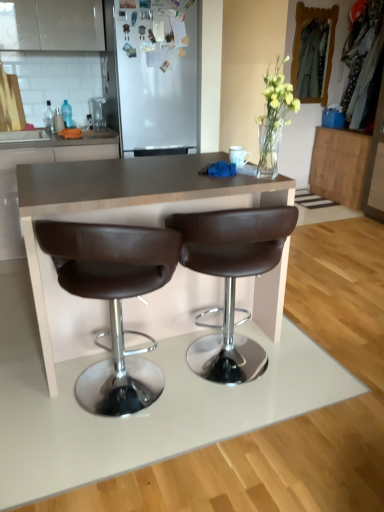
You are a GUI agent. You are given a task and a screenshot of the screen. Output one action in this format:
    pyautogui.click(x=<x>, y=<y>)
    Task: Click on the brown leather table at center
    
    Given the screenshot: What is the action you would take?
    pyautogui.click(x=117, y=223)

Image resolution: width=384 pixels, height=512 pixels. What do you see at coordinates (231, 278) in the screenshot?
I see `brown leather stool at center, the 2th chair positioned from the left` at bounding box center [231, 278].

Locate an element on the screen. Image resolution: width=384 pixels, height=512 pixels. brown leather stool at center, arranged as the 1th chair when viewed from the right is located at coordinates (231, 278).

Locate an element on the screen. brown leather stool at center, positioned as the first chair in left-to-right order is located at coordinates (113, 300).

What do you see at coordinates (113, 300) in the screenshot?
I see `brown leather stool at center, positioned as the first chair in left-to-right order` at bounding box center [113, 300].

Where is `white matte refrigerator at upper center`? This screenshot has width=384, height=512. white matte refrigerator at upper center is located at coordinates (154, 73).

This screenshot has width=384, height=512. Find the location of `wooden cabinet at right, placed as the 2th cabinetry when sorted from left to right`. wooden cabinet at right, placed as the 2th cabinetry when sorted from left to right is located at coordinates (340, 165).

Visually, is wooden cabinet at right, which ranks as the 1th cabinetry in back-to-front order, positioned to the left or to the right of brown leather cabinet at center, acting as the 1th cabinetry starting from the left?

wooden cabinet at right, which ranks as the 1th cabinetry in back-to-front order, is to the right of brown leather cabinet at center, acting as the 1th cabinetry starting from the left.

In the scene shown: Is wooden cabinet at right, which ranks as the 2th cabinetry in front-to-back order, facing away from brown leather cabinet at center, acting as the 1th cabinetry starting from the left?

No, wooden cabinet at right, which ranks as the 2th cabinetry in front-to-back order,'s orientation is not away from brown leather cabinet at center, acting as the 1th cabinetry starting from the left.

Does wooden cabinet at right, which ranks as the 2th cabinetry in front-to-back order, contain brown leather cabinet at center, placed as the 2th cabinetry when sorted from back to front?

No, brown leather cabinet at center, placed as the 2th cabinetry when sorted from back to front, is not a part of wooden cabinet at right, which ranks as the 2th cabinetry in front-to-back order.

Locate an element on the screen. This screenshot has width=384, height=512. cabinetry on the right of brown leather cabinet at center, arranged as the 1th cabinetry when viewed from the front is located at coordinates (340, 165).

From a real-world perspective, is white matte refrigerator at upper center positioned over brown leather table at center based on gravity?

Yes.

Is white matte refrigerator at upper center taller or shorter than brown leather table at center?

Considering their sizes, white matte refrigerator at upper center has more height than brown leather table at center.

How different are the orientations of white matte refrigerator at upper center and brown leather table at center in degrees?

They differ by 0.707 degrees in their facing directions.

In terms of size, does white matte refrigerator at upper center appear bigger or smaller than brown leather table at center?

white matte refrigerator at upper center is smaller than brown leather table at center.

From their relative heights in the image, would you say brown leather stool at center, positioned as the first chair in left-to-right order, is taller or shorter than brown leather cabinet at center, acting as the 1th cabinetry starting from the left?

Clearly, brown leather stool at center, positioned as the first chair in left-to-right order, is taller compared to brown leather cabinet at center, acting as the 1th cabinetry starting from the left.

Looking at their sizes, would you say brown leather stool at center, positioned as the first chair in left-to-right order, is wider or thinner than brown leather cabinet at center, acting as the 1th cabinetry starting from the left?

Clearly, brown leather stool at center, positioned as the first chair in left-to-right order, has less width compared to brown leather cabinet at center, acting as the 1th cabinetry starting from the left.

From the picture: Is the position of brown leather stool at center, positioned as the first chair in left-to-right order, more distant than that of brown leather cabinet at center, arranged as the 1th cabinetry when viewed from the front?

No, the depth of brown leather stool at center, positioned as the first chair in left-to-right order, is less than that of brown leather cabinet at center, arranged as the 1th cabinetry when viewed from the front.

Is brown leather stool at center, positioned as the first chair in left-to-right order, with brown leather cabinet at center, arranged as the 1th cabinetry when viewed from the front?

No, brown leather stool at center, positioned as the first chair in left-to-right order, is not next to brown leather cabinet at center, arranged as the 1th cabinetry when viewed from the front.

From the image's perspective, is wooden cabinet at right, placed as the 2th cabinetry when sorted from left to right, above or below matte white drawer at left?

From the image's perspective, wooden cabinet at right, placed as the 2th cabinetry when sorted from left to right, appears above matte white drawer at left.

Is wooden cabinet at right, which ranks as the 2th cabinetry in front-to-back order, facing away from matte white drawer at left?

No.

Which of these two, wooden cabinet at right, placed as the 2th cabinetry when sorted from left to right, or matte white drawer at left, is wider?

matte white drawer at left is wider.

Can you tell me how much wooden cabinet at right, which ranks as the 1th cabinetry in back-to-front order, and matte white drawer at left differ in facing direction?

They differ by 90.1 degrees in their facing directions.

Which cabinetry is the 1st one when counting from the back of the brown leather stool at center, acting as the second chair starting from the right? Please provide its 2D coordinates.

[(42, 162)]

Can you confirm if brown leather cabinet at center, acting as the 1th cabinetry starting from the left, is smaller than brown leather stool at center, acting as the second chair starting from the right?

Actually, brown leather cabinet at center, acting as the 1th cabinetry starting from the left, might be larger than brown leather stool at center, acting as the second chair starting from the right.

Considering the positions of objects brown leather cabinet at center, acting as the 1th cabinetry starting from the left, and brown leather stool at center, positioned as the first chair in left-to-right order, in the image provided, who is more to the left, brown leather cabinet at center, acting as the 1th cabinetry starting from the left, or brown leather stool at center, positioned as the first chair in left-to-right order,?

brown leather cabinet at center, acting as the 1th cabinetry starting from the left, is more to the left.

Is brown leather cabinet at center, the 2th cabinetry in the right-to-left sequence, oriented away from brown leather stool at center, positioned as the first chair in left-to-right order?

No.

Does brown leather table at center contain brown leather cabinet at center, acting as the 1th cabinetry starting from the left?

No, brown leather table at center does not contain brown leather cabinet at center, acting as the 1th cabinetry starting from the left.

Is brown leather table at center not near brown leather cabinet at center, arranged as the 1th cabinetry when viewed from the front?

Yes.

Can you confirm if brown leather table at center is positioned to the right of brown leather cabinet at center, acting as the 1th cabinetry starting from the left?

Yes, brown leather table at center is to the right of brown leather cabinet at center, acting as the 1th cabinetry starting from the left.

How many degrees apart are the facing directions of white matte refrigerator at upper center and matte white drawer at left?

The angular difference between white matte refrigerator at upper center and matte white drawer at left is 0.000327 degrees.

From a real-world perspective, relative to matte white drawer at left, is white matte refrigerator at upper center vertically above or below?

white matte refrigerator at upper center is situated higher than matte white drawer at left in the real world.

Which object is positioned more to the left, white matte refrigerator at upper center or matte white drawer at left?

matte white drawer at left is more to the left.

Considering the sizes of white matte refrigerator at upper center and matte white drawer at left in the image, is white matte refrigerator at upper center wider or thinner than matte white drawer at left?

In the image, white matte refrigerator at upper center appears to be wider than matte white drawer at left.

I want to click on cabinetry lying in front of the wooden cabinet at right, placed as the 2th cabinetry when sorted from left to right, so click(42, 162).

The height and width of the screenshot is (512, 384). In order to click on fridge that is above the brown leather table at center (from the image's perspective) in this screenshot , I will do `click(154, 73)`.

Looking at this image, estimate the real-world distances between objects in this image. Which object is closer to brown leather stool at center, the 2th chair positioned from the left, brown leather cabinet at center, placed as the 2th cabinetry when sorted from back to front, or matte white drawer at left?

Among the two, brown leather cabinet at center, placed as the 2th cabinetry when sorted from back to front, is located nearer to brown leather stool at center, the 2th chair positioned from the left.

When comparing their distances from white matte refrigerator at upper center, does matte white drawer at left or brown leather stool at center, positioned as the first chair in left-to-right order, seem closer?

Among the two, matte white drawer at left is located nearer to white matte refrigerator at upper center.

From the image, which object appears to be farther from wooden cabinet at right, which ranks as the 1th cabinetry in back-to-front order, matte white drawer at left or brown leather stool at center, positioned as the first chair in left-to-right order?

brown leather stool at center, positioned as the first chair in left-to-right order, is further to wooden cabinet at right, which ranks as the 1th cabinetry in back-to-front order.

Which object lies further to the anchor point wooden cabinet at right, which ranks as the 2th cabinetry in front-to-back order, white matte refrigerator at upper center or brown leather table at center?

brown leather table at center.

Which object lies nearer to the anchor point brown leather table at center, brown leather stool at center, acting as the second chair starting from the right, or brown leather stool at center, arranged as the 1th chair when viewed from the right?

brown leather stool at center, arranged as the 1th chair when viewed from the right, is positioned closer to the anchor brown leather table at center.

From the image, which object appears to be nearer to brown leather stool at center, arranged as the 1th chair when viewed from the right, brown leather stool at center, positioned as the first chair in left-to-right order, or matte white drawer at left?

brown leather stool at center, positioned as the first chair in left-to-right order, is closer to brown leather stool at center, arranged as the 1th chair when viewed from the right.

Which object lies further to the anchor point brown leather stool at center, positioned as the first chair in left-to-right order, brown leather cabinet at center, acting as the 1th cabinetry starting from the left, or matte white drawer at left?

The object further to brown leather stool at center, positioned as the first chair in left-to-right order, is matte white drawer at left.

Based on their spatial positions, is brown leather stool at center, acting as the second chair starting from the right, or white matte refrigerator at upper center closer to brown leather cabinet at center, placed as the 2th cabinetry when sorted from back to front?

white matte refrigerator at upper center is closer to brown leather cabinet at center, placed as the 2th cabinetry when sorted from back to front.

Locate an element on the screen. This screenshot has width=384, height=512. table between white matte refrigerator at upper center and brown leather stool at center, the 2th chair positioned from the left, vertically is located at coordinates (117, 223).

Where is `cabinetry located between brown leather table at center and matte white drawer at left in the depth direction`? This screenshot has height=512, width=384. cabinetry located between brown leather table at center and matte white drawer at left in the depth direction is located at coordinates [42, 162].

Identify the location of table between white matte refrigerator at upper center and brown leather stool at center, acting as the second chair starting from the right, vertically. (117, 223).

Find the location of a particular element. This screenshot has height=512, width=384. cabinetry situated between matte white drawer at left and wooden cabinet at right, which ranks as the 1th cabinetry in back-to-front order, from left to right is located at coordinates (42, 162).